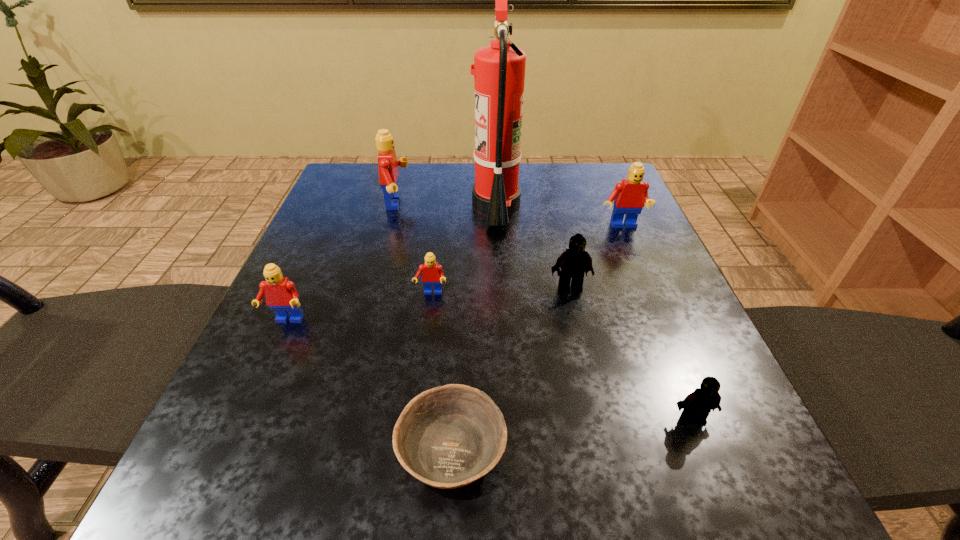
Identify the location of vacant space located 0.400m on the face of the third object from right to left. (622, 518).

Identify the location of free location located on the front-facing side of the leftmost object. This screenshot has width=960, height=540. (272, 352).

Locate an element on the screen. This screenshot has height=540, width=960. vacant space situated on the face of the smaller black Lego is located at coordinates (725, 498).

Locate an element on the screen. The image size is (960, 540). vacant region located 0.210m on the front-facing side of the second red Lego from right to left is located at coordinates (419, 396).

Locate an element on the screen. Image resolution: width=960 pixels, height=540 pixels. blank space located 0.190m on the left of the bowl is located at coordinates (257, 450).

This screenshot has width=960, height=540. In order to click on fire extinguisher located in the far edge section of the desktop in this screenshot , I will do `click(499, 69)`.

Locate an element on the screen. This screenshot has width=960, height=540. Lego at the far edge is located at coordinates (388, 165).

Where is `object present at the near edge`? object present at the near edge is located at coordinates (447, 437).

At what (x,y) coordinates should I click in order to perform the action: click on object located at the far left corner. Please return your answer as a coordinate pair (x, y). The width and height of the screenshot is (960, 540). Looking at the image, I should click on (388, 165).

In order to click on free space at the far edge of the desktop in this screenshot , I will do `click(461, 198)`.